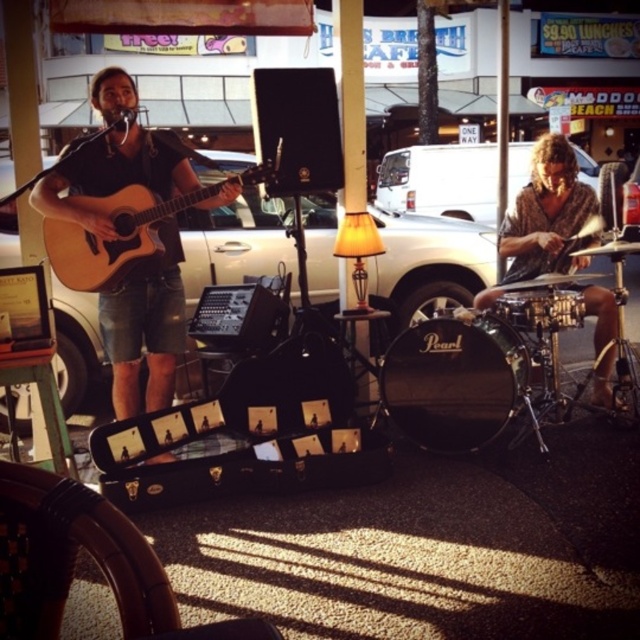
Is textured brown shirt at right smaller than natural wood acoustic guitar at left?

No.

Does textured brown shirt at right have a lesser width compared to natural wood acoustic guitar at left?

Correct, textured brown shirt at right's width is less than natural wood acoustic guitar at left's.

Which is behind, point (509, 273) or point (74, 262)?

The point (509, 273) is more distant.

Locate an element on the screen. The height and width of the screenshot is (640, 640). textured brown shirt at right is located at coordinates (547, 214).

Which is more to the right, matte brown guitar at left or black pearl drum at center?

Positioned to the right is black pearl drum at center.

Does matte brown guitar at left appear on the left side of black pearl drum at center?

Indeed, matte brown guitar at left is positioned on the left side of black pearl drum at center.

Is point (131, 387) more distant than point (516, 356)?

No, (131, 387) is closer to viewer.

Find the location of a particular element. matte brown guitar at left is located at coordinates (145, 326).

Does black pearl drum at center appear on the left side of natural wood acoustic guitar at left?

Incorrect, black pearl drum at center is not on the left side of natural wood acoustic guitar at left.

Which is behind, point (426, 324) or point (148, 241)?

Point (426, 324)

Identify the location of black pearl drum at center. This screenshot has height=640, width=640. (454, 380).